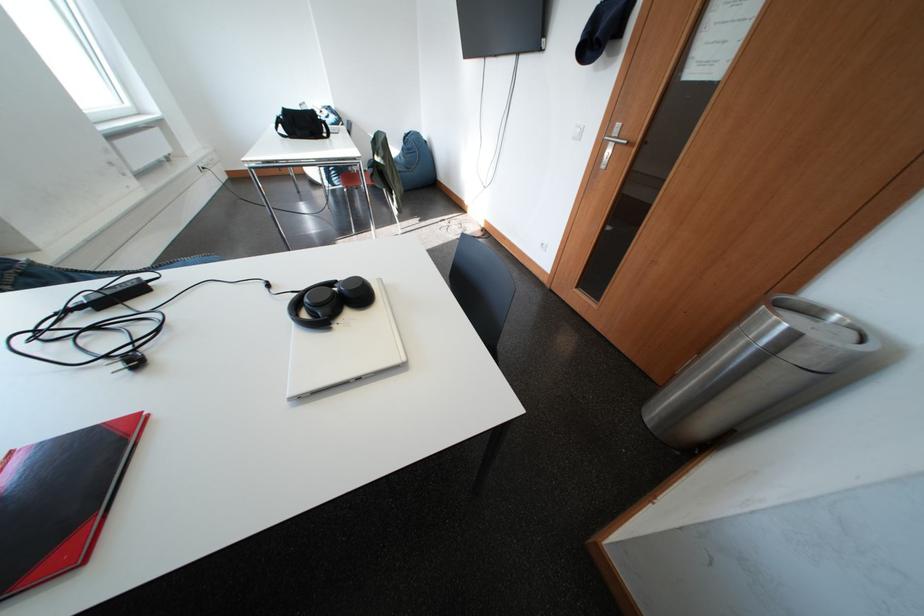
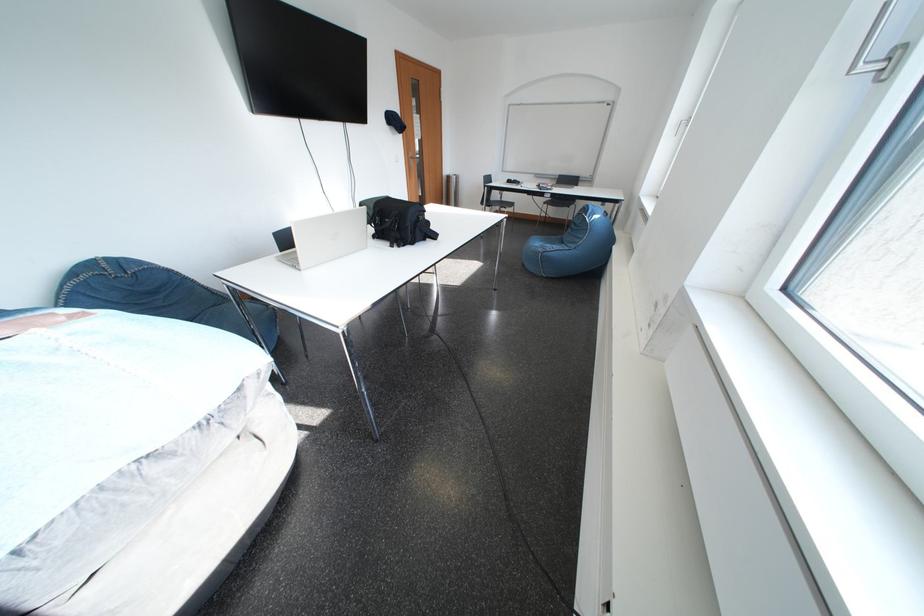
Question: I am providing you with two images of the same scene from different viewpoints. Please identify which objects are invisible in image2.

Choices:
 (A) wooden drawer
 (B) blue sofa sitting surface
 (C) chair sitting surface
 (D) white laptop

Answer: (C)